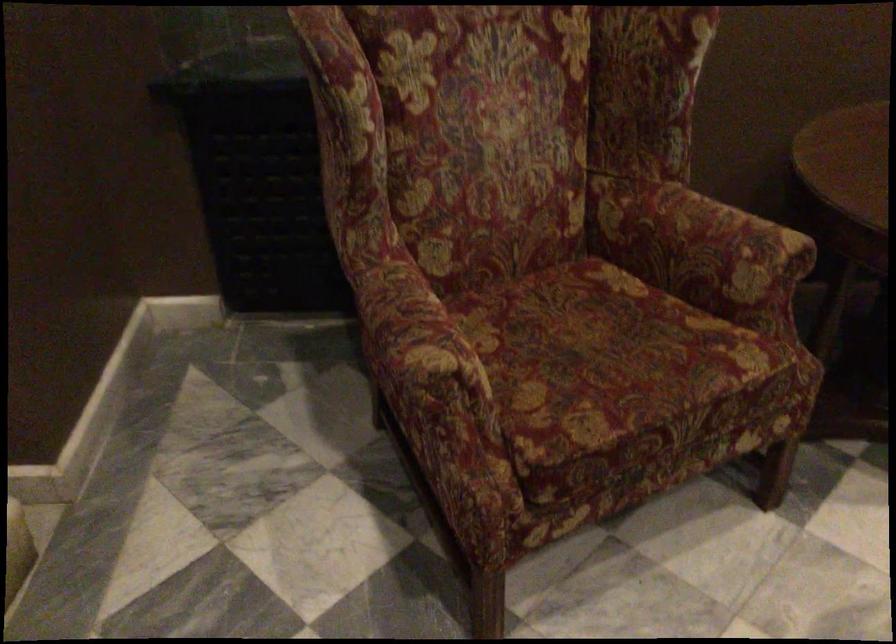
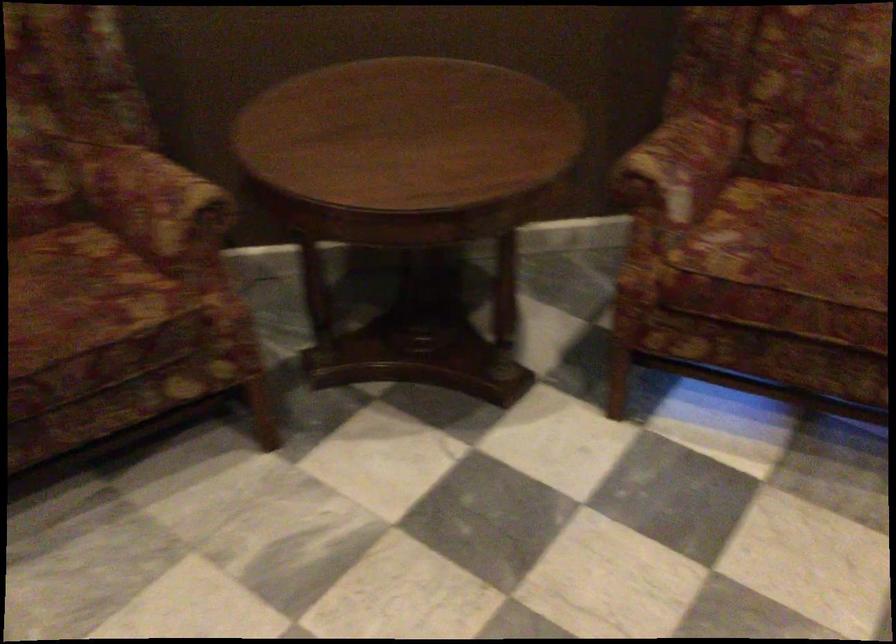
Question: How did the camera likely rotate?

Choices:
 (A) Left
 (B) Right
 (C) Up
 (D) Down

Answer: (B)